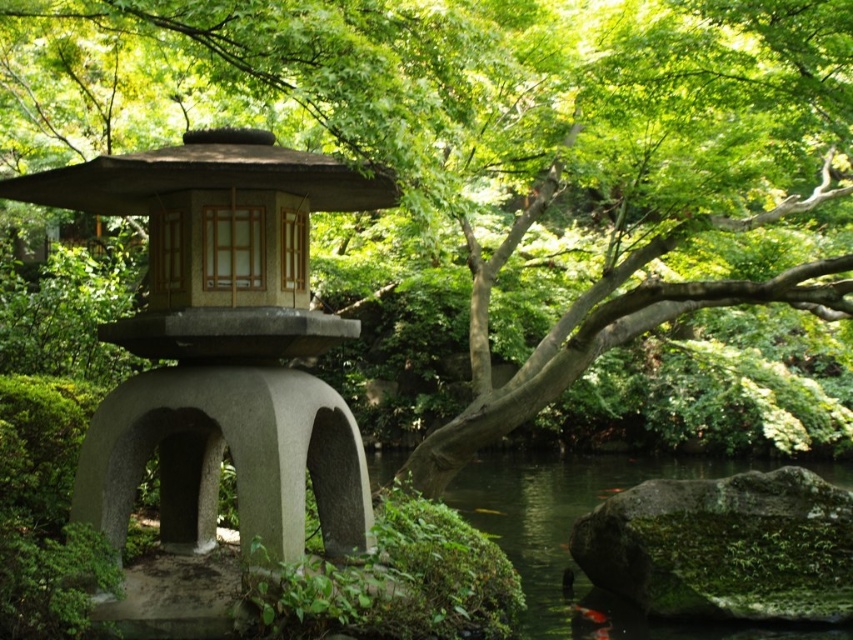
You are standing in the Japanese garden and want to walk from the point at coordinates [120,188] to the point at coordinates [389,452]. Will you walk towards or away from the traditional lantern structure?

Since point [120,188] is in front of point [389,452], walking from the first point to the second would mean moving away from the traditional lantern structure.

You are a visitor in the garden and want to take a photo of the matte stone lantern at center. Since you are standing on the green mossy water at lower center, can you take a clear photo without getting your feet wet?

The matte stone lantern at center is positioned over the green mossy water at lower center, so you can take a clear photo while standing on the green mossy water at lower center without getting your feet wet.

Looking at this image, you are a landscape architect designing a pathway through the garden. You need to place a decorative stone between the matte stone lantern at center and the green mossy rock at lower right. Which side of the path should the stone be placed closer to, considering their widths?

The matte stone lantern at center is wider than the green mossy rock at lower right. Therefore, the decorative stone should be placed closer to the green mossy rock at lower right to balance the path design.